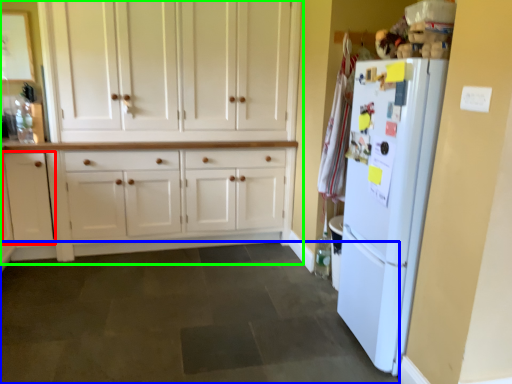
Question: Considering the real-world distances, which object is farthest from cabinetry (highlighted by a red box)? plain (highlighted by a blue box) or cabinetry (highlighted by a green box)?

Choices:
 (A) plain
 (B) cabinetry

Answer: (A)